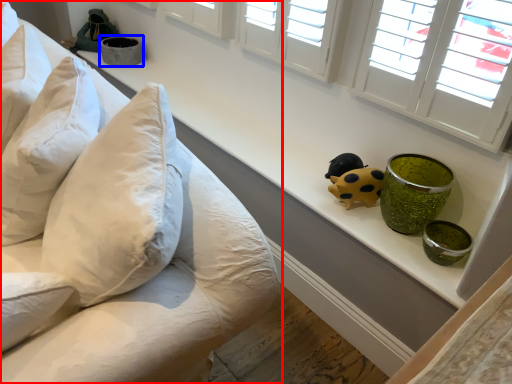
Question: Which point is further to the camera, furniture (highlighted by a red box) or glass bowl (highlighted by a blue box)?

Choices:
 (A) furniture
 (B) glass bowl

Answer: (B)